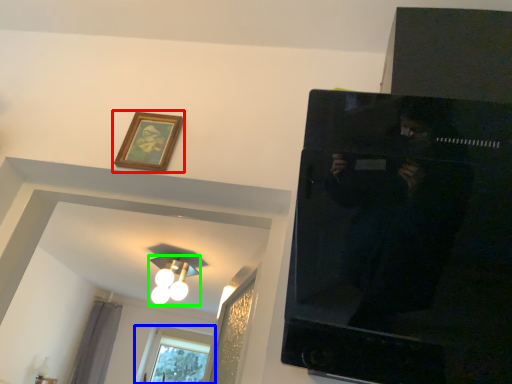
Question: Based on their relative distances, which object is nearer to picture frame (highlighted by a red box)? Choose from window (highlighted by a blue box) and light fixture (highlighted by a green box).

Choices:
 (A) window
 (B) light fixture

Answer: (B)